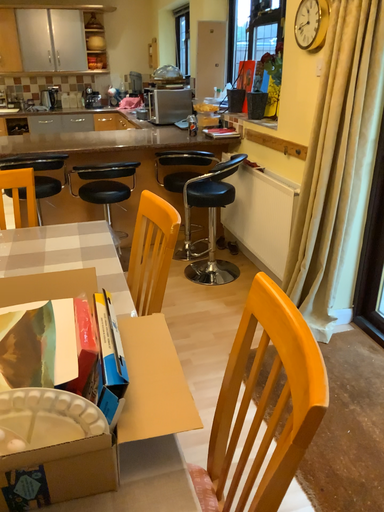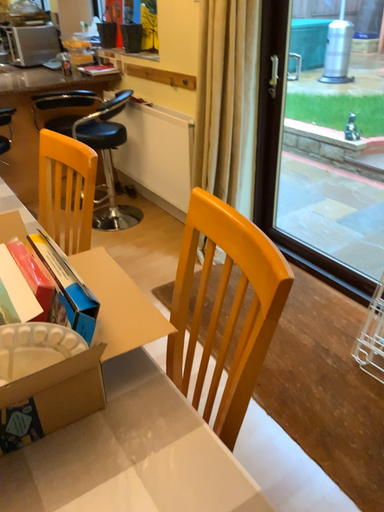
Question: Which way did the camera rotate in the video?

Choices:
 (A) rotated right
 (B) rotated left

Answer: (A)